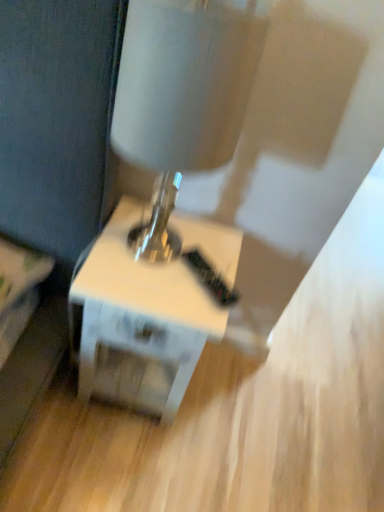
The height and width of the screenshot is (512, 384). Identify the location of free space above white glossy table at center (from a real-world perspective). (170, 259).